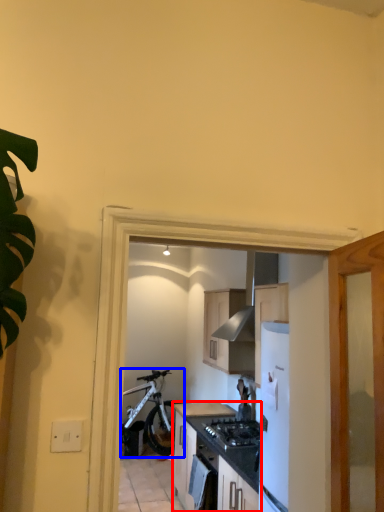
Question: Which of the following is the farthest to the observer, cabinetry (highlighted by a red box) or bicycle (highlighted by a blue box)?

Choices:
 (A) cabinetry
 (B) bicycle

Answer: (B)